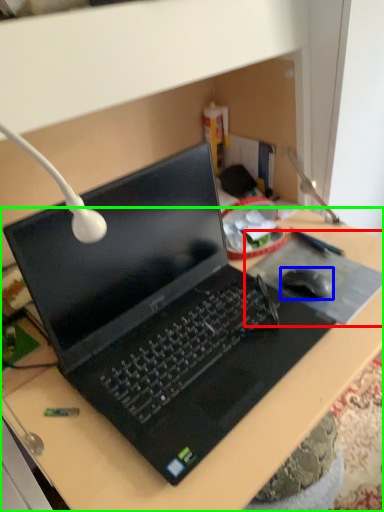
Question: Which object is positioned closest to mousepad (highlighted by a red box)? Select from mouse (highlighted by a blue box) and desk (highlighted by a green box).

Choices:
 (A) mouse
 (B) desk

Answer: (A)